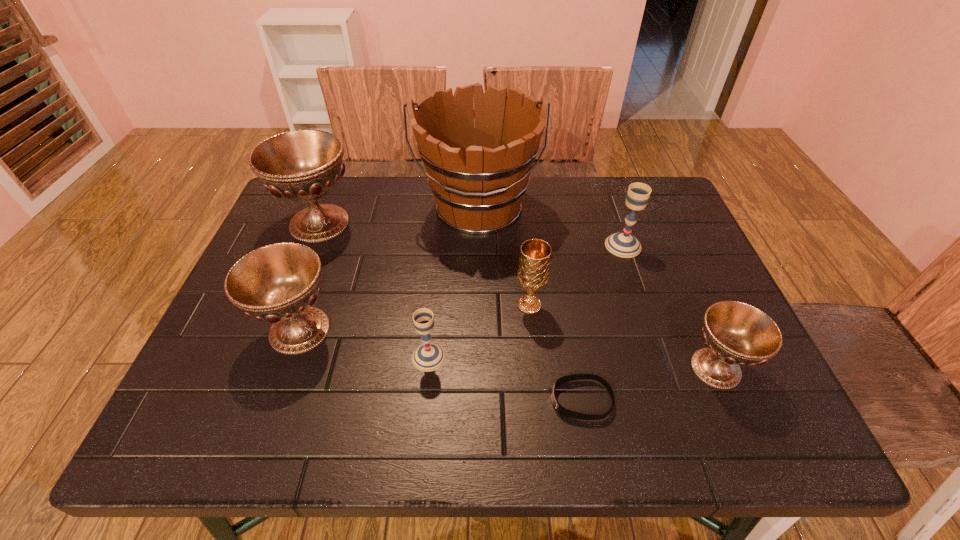
Locate an element on the screen. vacant area at the near right corner is located at coordinates (744, 406).

Image resolution: width=960 pixels, height=540 pixels. Find the location of `unoccupied position between the tallest object and the smaller gray chalice`. unoccupied position between the tallest object and the smaller gray chalice is located at coordinates (453, 283).

Where is `empty location between the farthest red chalice and the wristband`? The height and width of the screenshot is (540, 960). empty location between the farthest red chalice and the wristband is located at coordinates (450, 312).

Identify the location of vacant area between the third chalice from right to left and the right gray chalice. (576, 275).

Identify the location of unoccupied position between the tallest chalice and the wristband. The height and width of the screenshot is (540, 960). (450, 312).

Identify the location of free space between the tallest chalice and the tallest object. This screenshot has height=540, width=960. (398, 215).

Locate an element on the screen. The width and height of the screenshot is (960, 540). blank region between the right gray chalice and the second smallest red chalice is located at coordinates (462, 288).

Where is `free space between the tallest object and the second biggest red chalice`? Image resolution: width=960 pixels, height=540 pixels. free space between the tallest object and the second biggest red chalice is located at coordinates (389, 269).

Image resolution: width=960 pixels, height=540 pixels. Find the location of `free space that is in between the second biggest red chalice and the fourth chalice from right to left`. free space that is in between the second biggest red chalice and the fourth chalice from right to left is located at coordinates (365, 343).

Find the location of a particular element. This screenshot has width=960, height=540. object that is the closest one to the wristband is located at coordinates (533, 269).